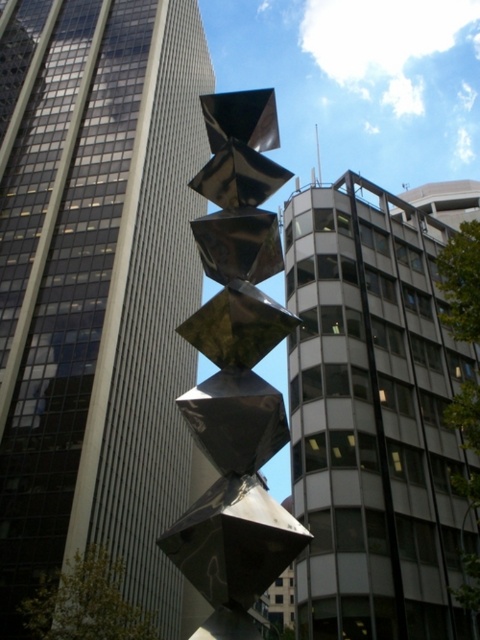
Is metallic glass building at center positioned at the back of metallic reflective cubes at center?

Yes, metallic glass building at center is further from the viewer.

Does metallic glass building at center have a greater width compared to metallic reflective cubes at center?

Yes, metallic glass building at center is wider than metallic reflective cubes at center.

What do you see at coordinates (373, 417) in the screenshot? The image size is (480, 640). I see `metallic glass building at center` at bounding box center [373, 417].

Where is `metallic glass building at center`? Image resolution: width=480 pixels, height=640 pixels. metallic glass building at center is located at coordinates (373, 417).

Does smooth glass skyscraper at center come in front of metallic reflective cubes at center?

No, it is behind metallic reflective cubes at center.

Can you confirm if smooth glass skyscraper at center is smaller than metallic reflective cubes at center?

No, smooth glass skyscraper at center is not smaller than metallic reflective cubes at center.

Who is more distant from viewer, (31, 138) or (274, 346)?

Positioned behind is point (31, 138).

The width and height of the screenshot is (480, 640). Find the location of `smooth glass skyscraper at center`. smooth glass skyscraper at center is located at coordinates (97, 288).

Does smooth glass skyscraper at center have a greater width compared to metallic glass building at center?

Yes, smooth glass skyscraper at center is wider than metallic glass building at center.

From the picture: Is smooth glass skyscraper at center bigger than metallic glass building at center?

Indeed, smooth glass skyscraper at center has a larger size compared to metallic glass building at center.

Which is in front, point (24, 308) or point (348, 266)?

Point (348, 266) is in front.

You are a GUI agent. You are given a task and a screenshot of the screen. Output one action in this format:
    pyautogui.click(x=<x>, y=<y>)
    Task: Click on the smooth glass skyscraper at center
    
    Given the screenshot: What is the action you would take?
    tap(97, 288)